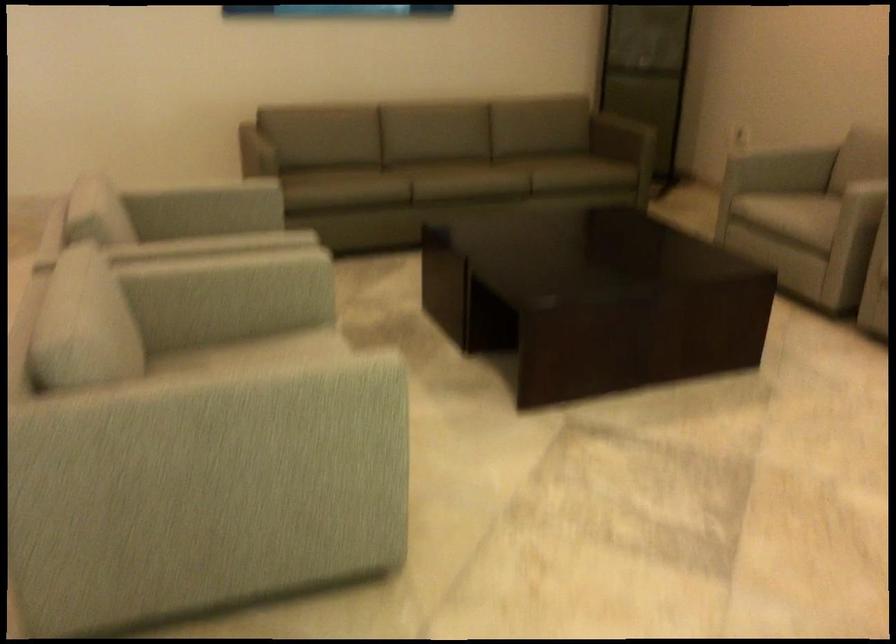
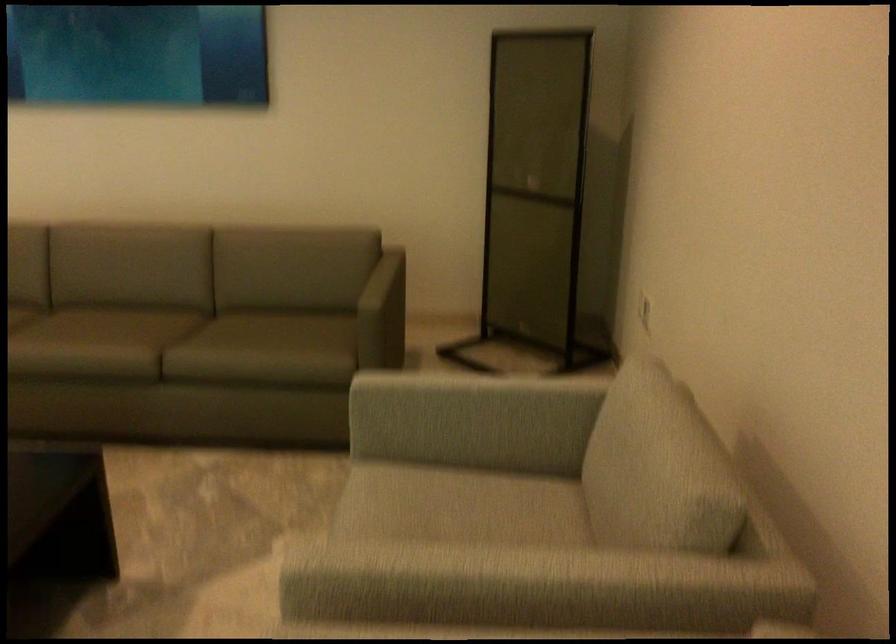
Where in the second image is the point corresponding to point (641, 70) from the first image?

(536, 194)